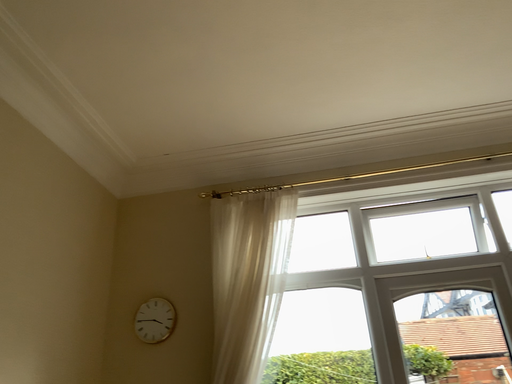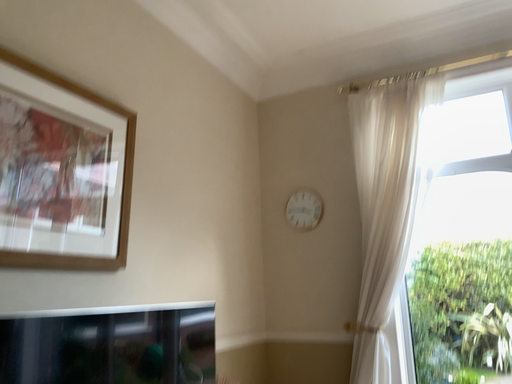
Question: How did the camera likely rotate when shooting the video?

Choices:
 (A) rotated right
 (B) rotated left

Answer: (B)